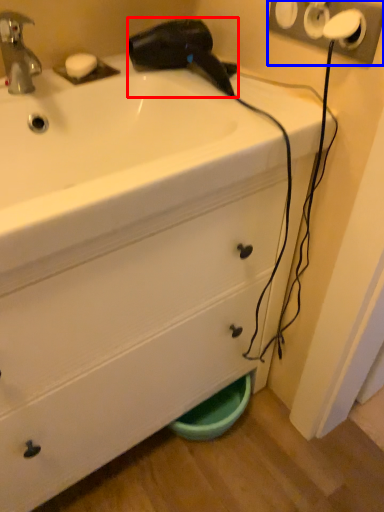
Question: Among these objects, which one is farthest to the camera, hair drier (highlighted by a red box) or electric outlet (highlighted by a blue box)?

Choices:
 (A) hair drier
 (B) electric outlet

Answer: (A)